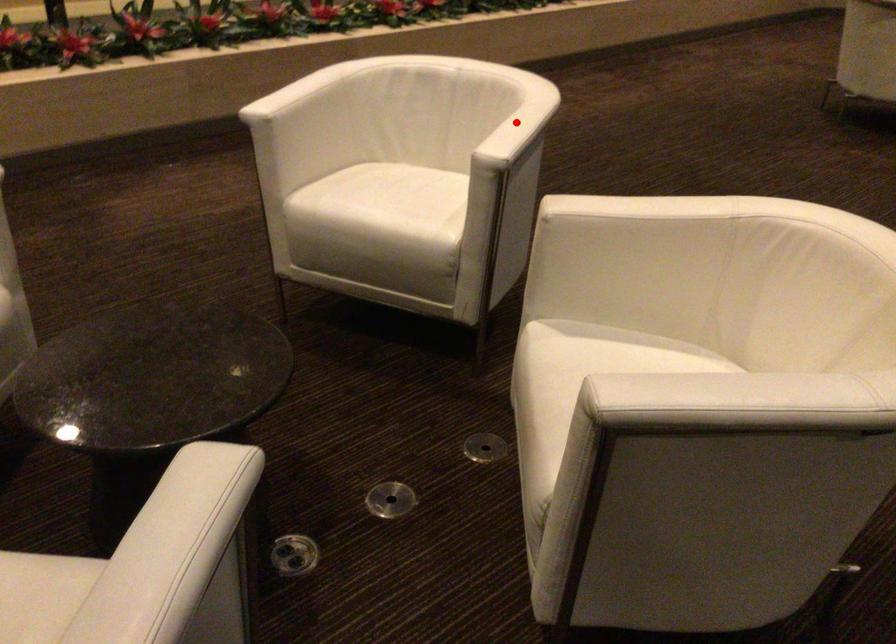
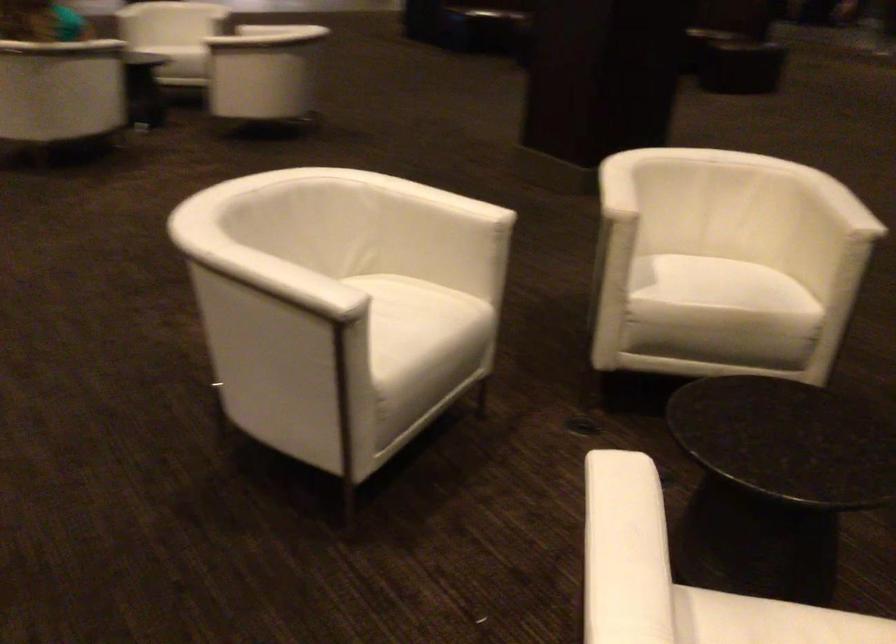
Question: I am providing you with two images of the same scene from different viewpoints. A red point is marked on the first image. Is the red point's position out of view in image 2?

Choices:
 (A) Yes
 (B) No

Answer: (A)